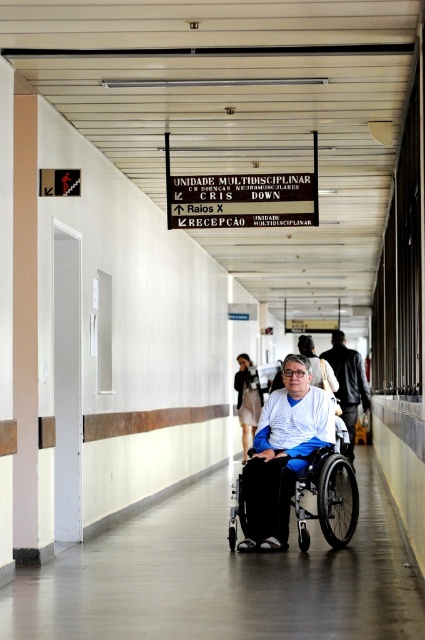
Is blue fabric wheelchair at center in front of light beige fabric dress at center?

Yes.

Can you confirm if blue fabric wheelchair at center is bigger than light beige fabric dress at center?

Indeed, blue fabric wheelchair at center has a larger size compared to light beige fabric dress at center.

You are a GUI agent. You are given a task and a screenshot of the screen. Output one action in this format:
    pyautogui.click(x=<x>, y=<y>)
    Task: Click on the blue fabric wheelchair at center
    
    Given the screenshot: What is the action you would take?
    pyautogui.click(x=348, y=381)

You are a GUI agent. You are given a task and a screenshot of the screen. Output one action in this format:
    pyautogui.click(x=<x>, y=<y>)
    Task: Click on the blue fabric wheelchair at center
    This screenshot has width=425, height=640.
    Given the screenshot: What is the action you would take?
    click(x=348, y=381)

Does point (206, 196) lie behind point (340, 396)?

That is False.

Is black plastic sign at upper center below blue fabric wheelchair at center?

No, black plastic sign at upper center is not below blue fabric wheelchair at center.

Is point (274, 221) closer to viewer compared to point (326, 355)?

Yes, point (274, 221) is in front of point (326, 355).

The image size is (425, 640). Identify the location of black plastic sign at upper center. (241, 196).

Looking at this image, who is higher up, silver metallic wheelchair at center or light beige fabric dress at center?

Positioned higher is light beige fabric dress at center.

Who is positioned more to the right, silver metallic wheelchair at center or light beige fabric dress at center?

Positioned to the right is silver metallic wheelchair at center.

Measure the distance between point (334, 458) and camera.

8.32 meters

Locate an element on the screen. Image resolution: width=425 pixels, height=640 pixels. silver metallic wheelchair at center is located at coordinates (328, 492).